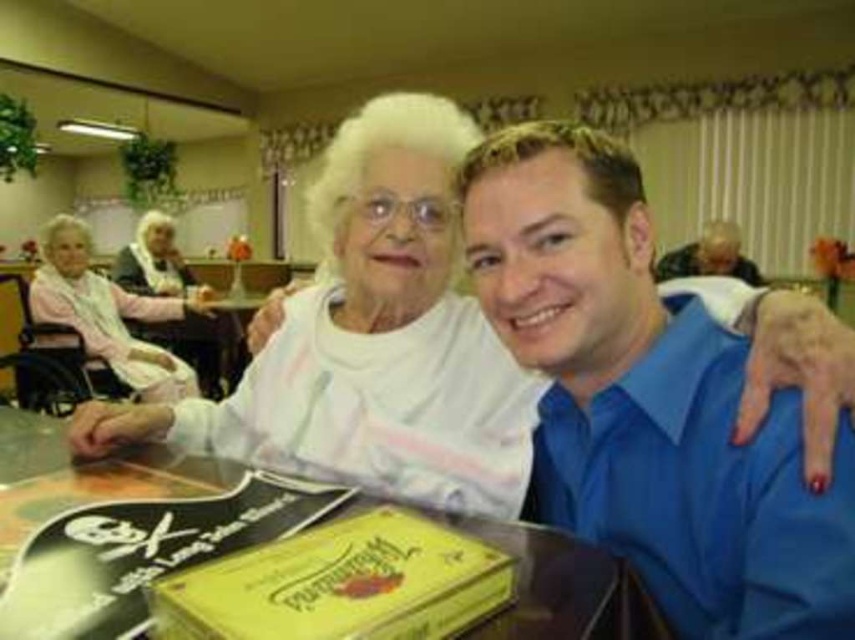
You are organizing a gift exchange event and need to place the yellow matte book at lower center and the pink fabric at left on a shelf. Based on their positions in the image, which item should you place higher on the shelf to maintain the same spatial relationship?

The pink fabric at left should be placed higher on the shelf than the yellow matte book at lower center to maintain the same spatial relationship.